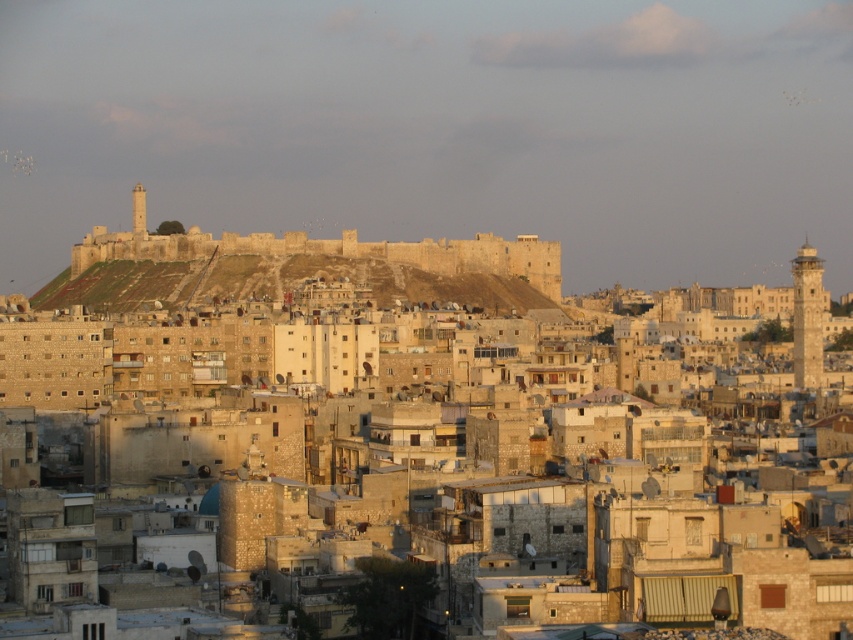
You are standing at the base of the hill where the fortress is located. You see two points marked in the image. Which point is closer to you, point (228, 454) or point (547, 253)?

Point (228, 454) is in front of point (547, 253), so it is closer to you.

Looking at this image, what is located at the point with coordinates [804,337] in the image?

The point at coordinates [804,337] corresponds to beige stone buildings at center.

Looking at this image, you are an urban planner assessing the layout of this Middle Eastern city. Given the beige stone buildings at center and the stone fortress at center, which structure occupies more horizontal space in the scene?

The beige stone buildings at center have a greater width than the stone fortress at center, so they occupy more horizontal space.